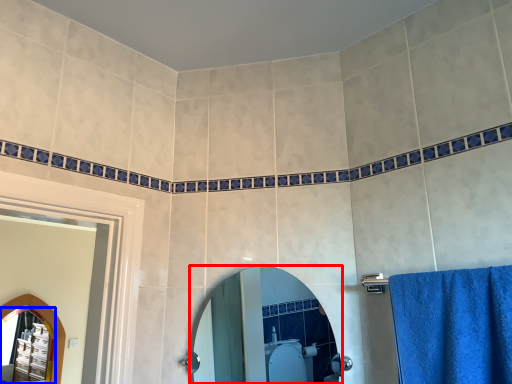
Question: Which object appears closest to the camera in this image, mirror (highlighted by a red box) or mirror (highlighted by a blue box)?

Choices:
 (A) mirror
 (B) mirror

Answer: (A)